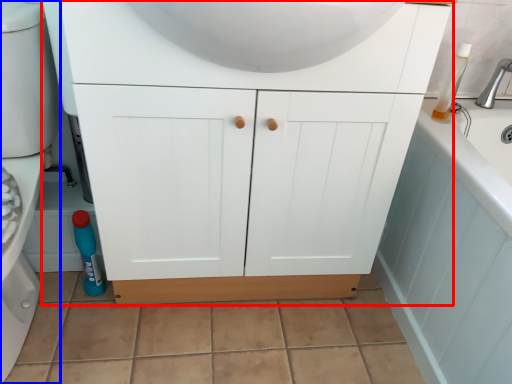
Question: Which object is further to the camera taking this photo, bathroom cabinet (highlighted by a red box) or porcelain (highlighted by a blue box)?

Choices:
 (A) bathroom cabinet
 (B) porcelain

Answer: (A)